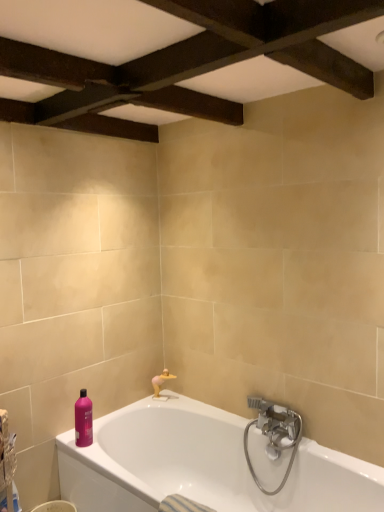
Question: Is plastic woven basket at lower left in front of matte gold faucet at lower center?

Choices:
 (A) no
 (B) yes

Answer: (B)

Question: Considering the relative positions of plastic woven basket at lower left and matte gold faucet at lower center in the image provided, is plastic woven basket at lower left to the right of matte gold faucet at lower center from the viewer's perspective?

Choices:
 (A) no
 (B) yes

Answer: (A)

Question: Can you confirm if plastic woven basket at lower left is taller than matte gold faucet at lower center?

Choices:
 (A) no
 (B) yes

Answer: (A)

Question: From the image's perspective, is plastic woven basket at lower left under matte gold faucet at lower center?

Choices:
 (A) yes
 (B) no

Answer: (A)

Question: Considering the relative sizes of plastic woven basket at lower left and matte gold faucet at lower center in the image provided, is plastic woven basket at lower left shorter than matte gold faucet at lower center?

Choices:
 (A) no
 (B) yes

Answer: (B)

Question: From the image's perspective, relative to satin nickel faucet at lower right, is matte gold faucet at lower center above or below?

Choices:
 (A) above
 (B) below

Answer: (A)

Question: From a real-world perspective, is matte gold faucet at lower center positioned above or below satin nickel faucet at lower right?

Choices:
 (A) above
 (B) below

Answer: (A)

Question: Is matte gold faucet at lower center inside the boundaries of satin nickel faucet at lower right, or outside?

Choices:
 (A) inside
 (B) outside

Answer: (B)

Question: Considering the positions of matte gold faucet at lower center and satin nickel faucet at lower right in the image, is matte gold faucet at lower center bigger or smaller than satin nickel faucet at lower right?

Choices:
 (A) big
 (B) small

Answer: (B)

Question: In the image, is white glossy bathtub at lower center positioned in front of or behind satin nickel faucet at lower right?

Choices:
 (A) front
 (B) behind

Answer: (A)

Question: From a real-world perspective, relative to satin nickel faucet at lower right, is white glossy bathtub at lower center vertically above or below?

Choices:
 (A) above
 (B) below

Answer: (B)

Question: Is point (329, 461) closer or farther from the camera than point (289, 468)?

Choices:
 (A) closer
 (B) farther

Answer: (A)

Question: Visually, is white glossy bathtub at lower center positioned to the left or to the right of satin nickel faucet at lower right?

Choices:
 (A) left
 (B) right

Answer: (A)

Question: Visually, is plastic woven basket at lower left positioned to the left or to the right of pink glossy bottle at lower left?

Choices:
 (A) left
 (B) right

Answer: (A)

Question: From the image's perspective, relative to pink glossy bottle at lower left, is plastic woven basket at lower left above or below?

Choices:
 (A) above
 (B) below

Answer: (A)